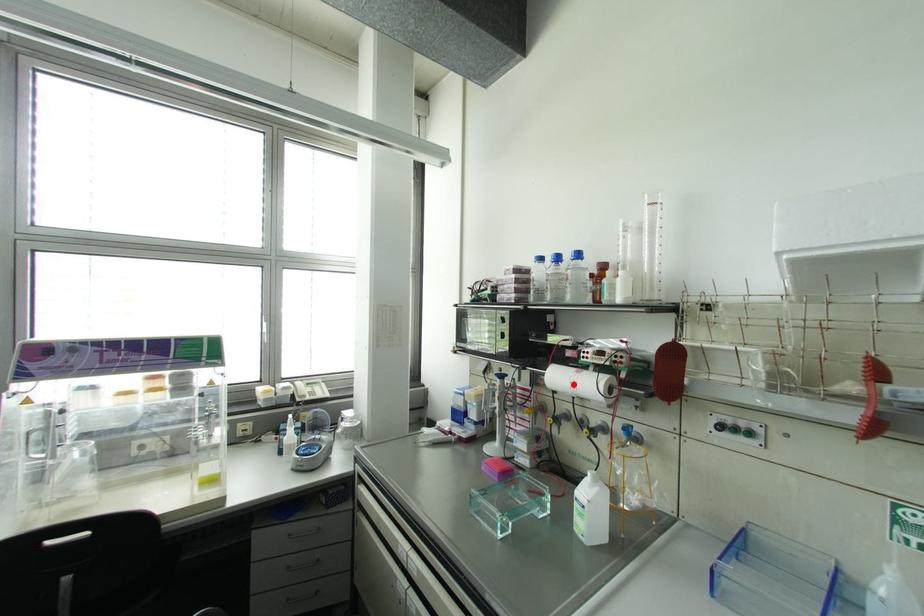
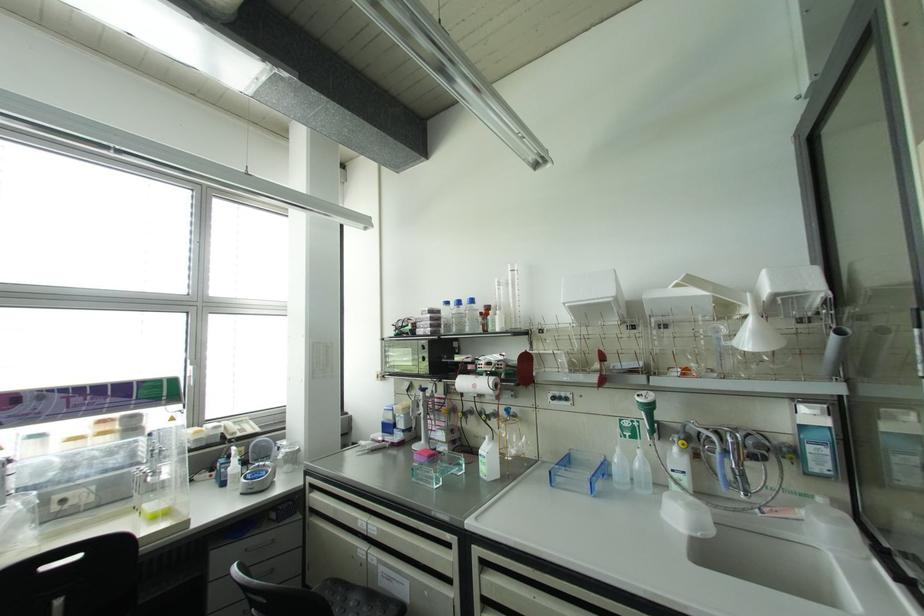
Question: I am providing you with two images of the same scene from different viewpoints. A red point is marked on the first image. Is the red point's position out of view in image 2?

Choices:
 (A) Yes
 (B) No

Answer: (B)